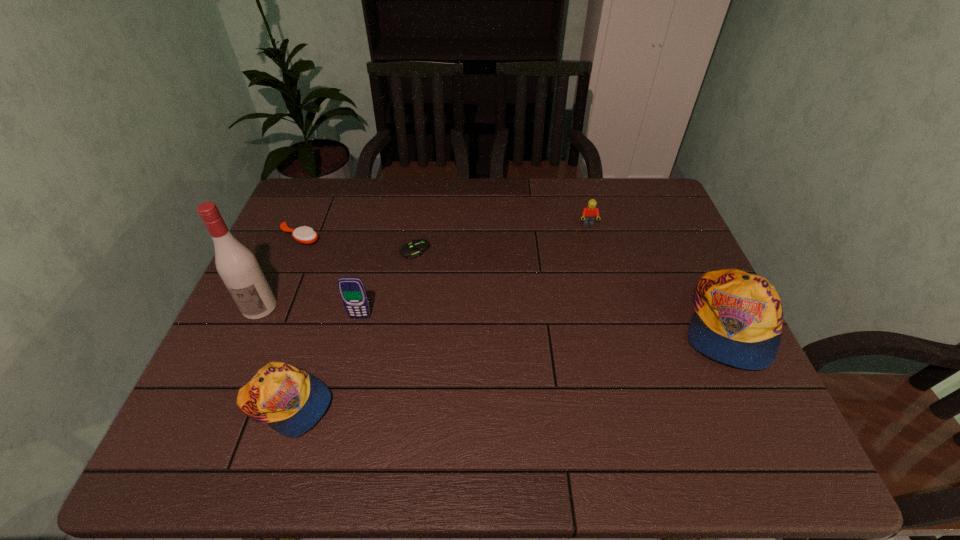
To ensure equal spacing by inserting another cap_(headwear) among them, please point out a vacant spot for this new cap_(headwear). Please provide its 2D coordinates. Your answer should be formatted as a tuple, i.e. [(x, y)], where the tuple contains the x and y coordinates of a point satisfying the conditions above.

[(523, 361)]